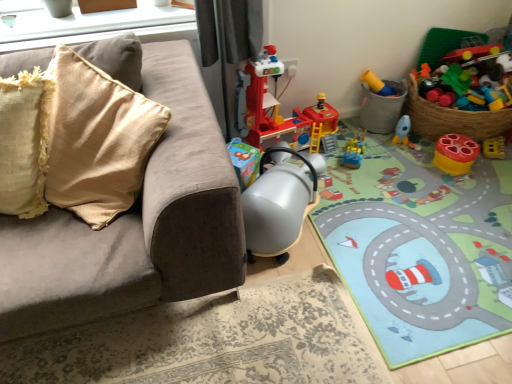
Where is `vacant space in front of translucent plastic train at center, positioned as the second toy in left-to-right order`? Image resolution: width=512 pixels, height=384 pixels. vacant space in front of translucent plastic train at center, positioned as the second toy in left-to-right order is located at coordinates (367, 177).